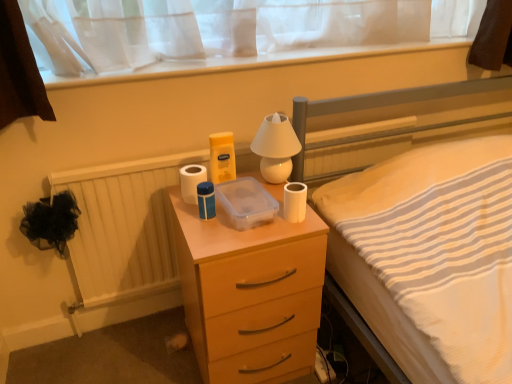
The height and width of the screenshot is (384, 512). What are the coordinates of `matte wood chest of drawers at center` in the screenshot? It's located at (250, 293).

The image size is (512, 384). Describe the element at coordinates (276, 147) in the screenshot. I see `white glossy lamp at upper center` at that location.

How much space does white matte toilet paper at right, arranged as the first toilet paper when viewed from the front, occupy horizontally?

2.73 inches.

Where is `white striped fabric at upper right`? The width and height of the screenshot is (512, 384). white striped fabric at upper right is located at coordinates (382, 106).

Identify the location of white matte toilet paper at center, the second toilet paper from the right. [x=191, y=181].

In order to face white matte toilet paper at center, positioned as the first toilet paper in left-to-right order, should I rotate leftwards or rightwards?

Rotate left and turn 8.235 degrees.

This screenshot has height=384, width=512. I want to click on matte wood chest of drawers at center, so click(250, 293).

Can you confirm if white matte toilet paper at right, which appears as the 2th toilet paper when viewed from the left, is wider than white matte toilet paper at center, the 2th toilet paper positioned from the front?

Incorrect, the width of white matte toilet paper at right, which appears as the 2th toilet paper when viewed from the left, does not surpass that of white matte toilet paper at center, the 2th toilet paper positioned from the front.

Is white matte toilet paper at right, which is the second toilet paper in back-to-front order, facing away from white matte toilet paper at center, positioned as the first toilet paper in left-to-right order?

That's not correct — white matte toilet paper at right, which is the second toilet paper in back-to-front order, is not looking away from white matte toilet paper at center, positioned as the first toilet paper in left-to-right order.

From the image's perspective, is white matte toilet paper at right, which is the second toilet paper in back-to-front order, located beneath white matte toilet paper at center, which is the first toilet paper from back to front?

Yes, from the image's perspective, white matte toilet paper at right, which is the second toilet paper in back-to-front order, is beneath white matte toilet paper at center, which is the first toilet paper from back to front.

Which object is closer to the camera taking this photo, white matte toilet paper at right, which appears as the 2th toilet paper when viewed from the left, or white matte toilet paper at center, the 2th toilet paper positioned from the front?

white matte toilet paper at right, which appears as the 2th toilet paper when viewed from the left, is closer to the camera.

At what (x,y) coordinates should I click in order to perform the action: click on bedside lamp that is in front of the white matte toilet paper at center, the second toilet paper from the right. Please return your answer as a coordinate pair (x, y). Looking at the image, I should click on (276, 147).

Can you confirm if white glossy lamp at upper center is bigger than white matte toilet paper at center, the second toilet paper from the right?

Correct, white glossy lamp at upper center is larger in size than white matte toilet paper at center, the second toilet paper from the right.

Visually, is white glossy lamp at upper center positioned to the left or to the right of white matte toilet paper at center, the second toilet paper from the right?

In the image, white glossy lamp at upper center appears on the right side of white matte toilet paper at center, the second toilet paper from the right.

Is white glossy lamp at upper center not inside white matte toilet paper at center, which is the first toilet paper from back to front?

Absolutely, white glossy lamp at upper center is external to white matte toilet paper at center, which is the first toilet paper from back to front.

From a real-world perspective, is white matte toilet paper at center, positioned as the first toilet paper in left-to-right order, physically above matte wood chest of drawers at center?

Yes, from a real-world perspective, white matte toilet paper at center, positioned as the first toilet paper in left-to-right order, is on top of matte wood chest of drawers at center.

Is white matte toilet paper at center, which is the first toilet paper from back to front, not close to matte wood chest of drawers at center?

No, there isn't a large distance between white matte toilet paper at center, which is the first toilet paper from back to front, and matte wood chest of drawers at center.

Which of these two, white matte toilet paper at center, the 2th toilet paper positioned from the front, or matte wood chest of drawers at center, is wider?

Wider between the two is matte wood chest of drawers at center.

Can you confirm if white matte toilet paper at center, which is the first toilet paper from back to front, is taller than matte wood chest of drawers at center?

Incorrect, the height of white matte toilet paper at center, which is the first toilet paper from back to front, is not larger of that of matte wood chest of drawers at center.

Based on their sizes in the image, would you say white matte toilet paper at center, the 2th toilet paper positioned from the front, is bigger or smaller than white matte toilet paper at right, which is the second toilet paper in back-to-front order?

Considering their sizes, white matte toilet paper at center, the 2th toilet paper positioned from the front, takes up more space than white matte toilet paper at right, which is the second toilet paper in back-to-front order.

Do you think white matte toilet paper at center, which is the first toilet paper from back to front, is within white matte toilet paper at right, which appears as the 2th toilet paper when viewed from the left, or outside of it?

The correct answer is: outside.

I want to click on toilet paper lying below the white matte toilet paper at center, the 2th toilet paper positioned from the front (from the image's perspective), so click(x=294, y=202).

From the image's perspective, between white matte toilet paper at center, positioned as the first toilet paper in left-to-right order, and white matte toilet paper at right, which appears as the 2th toilet paper when viewed from the left, who is located below?

white matte toilet paper at right, which appears as the 2th toilet paper when viewed from the left.

From the image's perspective, is white striped fabric at upper right positioned above or below white glossy lamp at upper center?

Based on their image positions, white striped fabric at upper right is located beneath white glossy lamp at upper center.

Is white striped fabric at upper right further to camera compared to white glossy lamp at upper center?

No, the depth of white striped fabric at upper right is less than that of white glossy lamp at upper center.

At what (x,y) coordinates should I click in order to perform the action: click on bed on the right side of white glossy lamp at upper center. Please return your answer as a coordinate pair (x, y). Looking at the image, I should click on (382, 106).

From the picture: From a real-world perspective, is white striped fabric at upper right physically located above or below white glossy lamp at upper center?

white striped fabric at upper right is below white glossy lamp at upper center.

From a real-world perspective, is white matte toilet paper at right, which is counted as the first toilet paper, starting from the right, above or below white glossy lamp at upper center?

In terms of real-world spatial position, white matte toilet paper at right, which is counted as the first toilet paper, starting from the right, is below white glossy lamp at upper center.

Can you confirm if white matte toilet paper at right, which appears as the 2th toilet paper when viewed from the left, is wider than white glossy lamp at upper center?

In fact, white matte toilet paper at right, which appears as the 2th toilet paper when viewed from the left, might be narrower than white glossy lamp at upper center.

From the image's perspective, is white matte toilet paper at right, which is counted as the first toilet paper, starting from the right, located above or below white glossy lamp at upper center?

Based on their image positions, white matte toilet paper at right, which is counted as the first toilet paper, starting from the right, is located beneath white glossy lamp at upper center.

Identify the location of chest of drawers on the right of white matte toilet paper at center, which is the first toilet paper from back to front. (250, 293).

Is matte wood chest of drawers at center aimed at white matte toilet paper at center, the second toilet paper from the right?

No, matte wood chest of drawers at center is not facing towards white matte toilet paper at center, the second toilet paper from the right.

In the scene shown: Which is closer, (200, 220) or (189, 202)?

The point (200, 220) is closer to the camera.

Is white matte toilet paper at center, the 2th toilet paper positioned from the front, located within matte wood chest of drawers at center?

No, matte wood chest of drawers at center does not contain white matte toilet paper at center, the 2th toilet paper positioned from the front.

This screenshot has height=384, width=512. I want to click on toilet paper behind the white matte toilet paper at right, which is counted as the first toilet paper, starting from the right, so click(x=191, y=181).

Find the location of a particular element. This screenshot has height=384, width=512. toilet paper that is the 1st object located below the white glossy lamp at upper center (from the image's perspective) is located at coordinates (191, 181).

Which object lies further to the anchor point white glossy lamp at upper center, white matte toilet paper at right, which appears as the 2th toilet paper when viewed from the left, or white striped fabric at upper right?

The object further to white glossy lamp at upper center is white striped fabric at upper right.

Considering their positions, is white striped fabric at upper right positioned further to white matte toilet paper at right, which is the second toilet paper in back-to-front order, than white matte toilet paper at center, the second toilet paper from the right?

white striped fabric at upper right is further to white matte toilet paper at right, which is the second toilet paper in back-to-front order.

Based on their spatial positions, is white matte toilet paper at center, which is the first toilet paper from back to front, or matte wood chest of drawers at center further from white matte toilet paper at right, which appears as the 2th toilet paper when viewed from the left?

Based on the image, matte wood chest of drawers at center appears to be further to white matte toilet paper at right, which appears as the 2th toilet paper when viewed from the left.

Estimate the real-world distances between objects in this image. Which object is further from white matte toilet paper at center, the 2th toilet paper positioned from the front, white glossy lamp at upper center or white striped fabric at upper right?

white striped fabric at upper right is positioned further to the anchor white matte toilet paper at center, the 2th toilet paper positioned from the front.

When comparing their distances from white matte toilet paper at right, which is counted as the first toilet paper, starting from the right, does matte wood chest of drawers at center or white matte toilet paper at center, the second toilet paper from the right, seem closer?

white matte toilet paper at center, the second toilet paper from the right, is positioned closer to the anchor white matte toilet paper at right, which is counted as the first toilet paper, starting from the right.

From the image, which object appears to be farther from white matte toilet paper at right, arranged as the first toilet paper when viewed from the front, white glossy lamp at upper center or matte wood chest of drawers at center?

matte wood chest of drawers at center lies further to white matte toilet paper at right, arranged as the first toilet paper when viewed from the front, than the other object.

From the image, which object appears to be farther from matte wood chest of drawers at center, white matte toilet paper at right, which appears as the 2th toilet paper when viewed from the left, or white matte toilet paper at center, which is the first toilet paper from back to front?

The object further to matte wood chest of drawers at center is white matte toilet paper at center, which is the first toilet paper from back to front.

When comparing their distances from matte wood chest of drawers at center, does white matte toilet paper at center, the 2th toilet paper positioned from the front, or white glossy lamp at upper center seem closer?

white matte toilet paper at center, the 2th toilet paper positioned from the front, lies closer to matte wood chest of drawers at center than the other object.

You are a GUI agent. You are given a task and a screenshot of the screen. Output one action in this format:
    pyautogui.click(x=<x>, y=<y>)
    Task: Click on the chest of drawers between white matte toilet paper at center, the second toilet paper from the right, and white striped fabric at upper right from left to right
    
    Given the screenshot: What is the action you would take?
    pyautogui.click(x=250, y=293)

I want to click on bedside lamp between white matte toilet paper at center, which is the first toilet paper from back to front, and white striped fabric at upper right from left to right, so (276, 147).

Identify the location of toilet paper between matte wood chest of drawers at center and white striped fabric at upper right from left to right. (294, 202).

Find the location of a particular element. toilet paper that lies between white matte toilet paper at center, the 2th toilet paper positioned from the front, and matte wood chest of drawers at center from top to bottom is located at coordinates (294, 202).